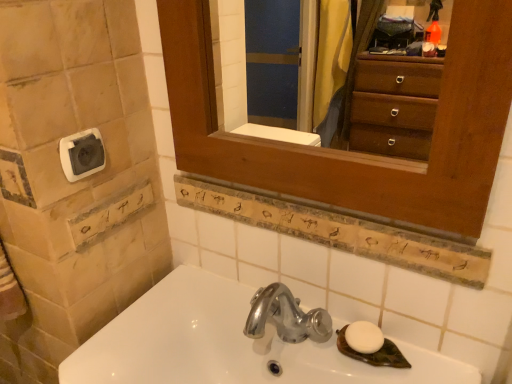
Question: Considering the relative positions of wooden sign at center and white plastic towel bar at upper left in the image provided, is wooden sign at center to the right of white plastic towel bar at upper left from the viewer's perspective?

Choices:
 (A) yes
 (B) no

Answer: (A)

Question: Is wooden sign at center oriented away from white plastic towel bar at upper left?

Choices:
 (A) no
 (B) yes

Answer: (A)

Question: From the image's perspective, is wooden sign at center located above white plastic towel bar at upper left?

Choices:
 (A) yes
 (B) no

Answer: (B)

Question: Is wooden sign at center further to camera compared to white plastic towel bar at upper left?

Choices:
 (A) no
 (B) yes

Answer: (A)

Question: Is white plastic towel bar at upper left surrounded by wooden sign at center?

Choices:
 (A) yes
 (B) no

Answer: (B)

Question: Considering the positions of white matte soap at lower right and white glossy sink at lower center in the image, is white matte soap at lower right taller or shorter than white glossy sink at lower center?

Choices:
 (A) short
 (B) tall

Answer: (A)

Question: From a real-world perspective, is white matte soap at lower right physically located above or below white glossy sink at lower center?

Choices:
 (A) above
 (B) below

Answer: (A)

Question: Is point (359, 326) positioned closer to the camera than point (315, 359)?

Choices:
 (A) closer
 (B) farther

Answer: (B)

Question: From the image's perspective, relative to white glossy sink at lower center, is white matte soap at lower right above or below?

Choices:
 (A) above
 (B) below

Answer: (A)

Question: Would you say wooden sign at center is inside or outside white matte soap at lower right?

Choices:
 (A) inside
 (B) outside

Answer: (B)

Question: Considering the positions of wooden sign at center and white matte soap at lower right in the image, is wooden sign at center wider or thinner than white matte soap at lower right?

Choices:
 (A) thin
 (B) wide

Answer: (A)

Question: Visually, is wooden sign at center positioned to the left or to the right of white matte soap at lower right?

Choices:
 (A) right
 (B) left

Answer: (B)

Question: Considering their positions, is wooden sign at center located in front of or behind white matte soap at lower right?

Choices:
 (A) behind
 (B) front

Answer: (B)

Question: Considering the positions of wooden medicine cabinet at upper center and white plastic towel bar at upper left in the image, is wooden medicine cabinet at upper center taller or shorter than white plastic towel bar at upper left?

Choices:
 (A) tall
 (B) short

Answer: (A)

Question: In terms of width, does wooden medicine cabinet at upper center look wider or thinner when compared to white plastic towel bar at upper left?

Choices:
 (A) wide
 (B) thin

Answer: (A)